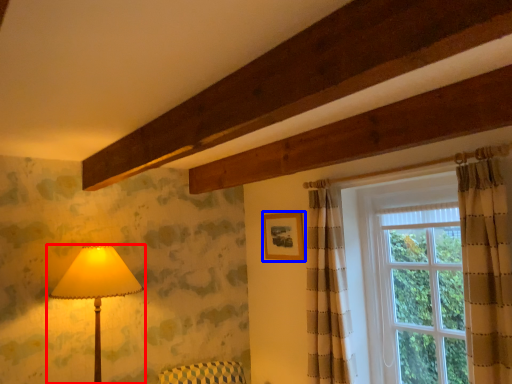
Question: Which of the following is the closest to the observer, lamp (highlighted by a red box) or picture frame (highlighted by a blue box)?

Choices:
 (A) lamp
 (B) picture frame

Answer: (A)